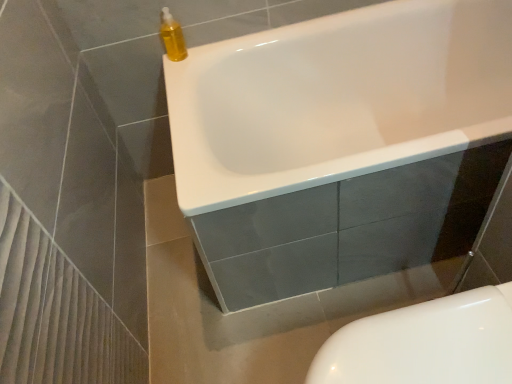
Question: From the image's perspective, is yellow translucent bottle at upper left below white glossy bathtub at upper center?

Choices:
 (A) no
 (B) yes

Answer: (A)

Question: Is the position of yellow translucent bottle at upper left more distant than that of white glossy bathtub at upper center?

Choices:
 (A) yes
 (B) no

Answer: (A)

Question: Is yellow translucent bottle at upper left beside white glossy bathtub at upper center?

Choices:
 (A) yes
 (B) no

Answer: (B)

Question: Can you confirm if yellow translucent bottle at upper left is thinner than white glossy bathtub at upper center?

Choices:
 (A) no
 (B) yes

Answer: (B)

Question: Is yellow translucent bottle at upper left to the left of white glossy bathtub at upper center from the viewer's perspective?

Choices:
 (A) yes
 (B) no

Answer: (A)

Question: Considering their positions, is white glossy toilet at lower right located in front of or behind yellow translucent bottle at upper left?

Choices:
 (A) behind
 (B) front

Answer: (B)

Question: From a real-world perspective, is white glossy toilet at lower right above or below yellow translucent bottle at upper left?

Choices:
 (A) above
 (B) below

Answer: (B)

Question: Considering the positions of white glossy toilet at lower right and yellow translucent bottle at upper left in the image, is white glossy toilet at lower right taller or shorter than yellow translucent bottle at upper left?

Choices:
 (A) short
 (B) tall

Answer: (B)

Question: Considering the positions of point (461, 349) and point (163, 44), is point (461, 349) closer or farther from the camera than point (163, 44)?

Choices:
 (A) farther
 (B) closer

Answer: (B)

Question: Based on their sizes in the image, would you say white glossy bathtub at upper center is bigger or smaller than white glossy toilet at lower right?

Choices:
 (A) big
 (B) small

Answer: (A)

Question: From a real-world perspective, is white glossy bathtub at upper center positioned above or below white glossy toilet at lower right?

Choices:
 (A) below
 (B) above

Answer: (B)

Question: Is white glossy bathtub at upper center taller or shorter than white glossy toilet at lower right?

Choices:
 (A) tall
 (B) short

Answer: (A)

Question: In the image, is white glossy bathtub at upper center on the left side or the right side of white glossy toilet at lower right?

Choices:
 (A) right
 (B) left

Answer: (A)

Question: From the image's perspective, is white glossy toilet at lower right above or below white glossy bathtub at upper center?

Choices:
 (A) above
 (B) below

Answer: (B)

Question: Is point (488, 322) positioned closer to the camera than point (374, 125)?

Choices:
 (A) closer
 (B) farther

Answer: (A)